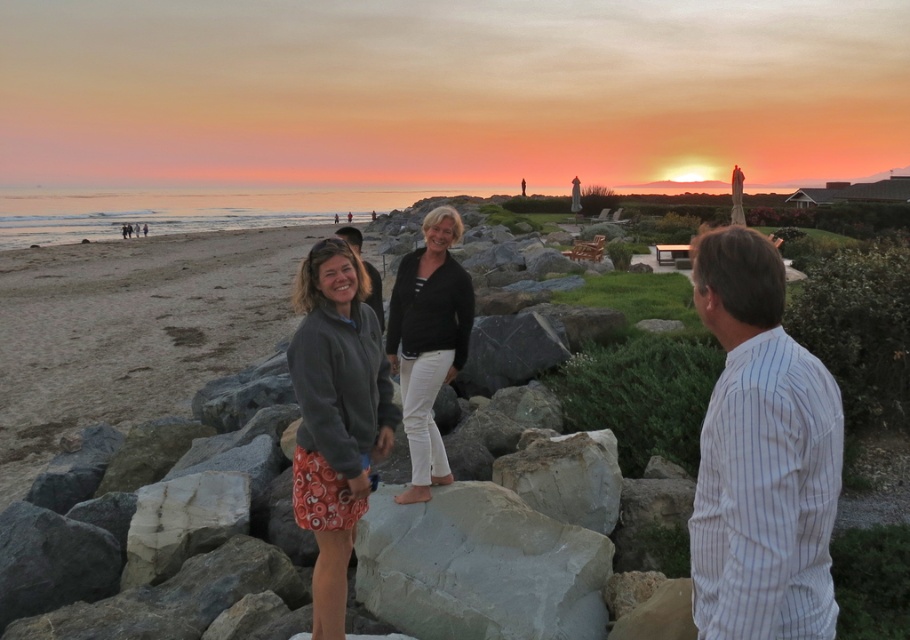
Is gray smooth rock at center thinner than white cotton pants at center?

No.

Who is higher up, gray smooth rock at center or white cotton pants at center?

Positioned higher is white cotton pants at center.

Does point (541, 572) come farther from viewer compared to point (436, 214)?

No, (541, 572) is closer to viewer.

Identify the location of gray smooth rock at center. The width and height of the screenshot is (910, 640). (479, 566).

Is point (298, 381) positioned in front of point (383, 312)?

Yes, point (298, 381) is in front of point (383, 312).

Is orange printed skirt at center smaller than white shirt at center?

Correct, orange printed skirt at center occupies less space than white shirt at center.

You are a GUI agent. You are given a task and a screenshot of the screen. Output one action in this format:
    pyautogui.click(x=<x>, y=<y>)
    Task: Click on the orange printed skirt at center
    
    Given the screenshot: What is the action you would take?
    pyautogui.click(x=335, y=417)

How far apart are white cotton pants at center and white marble rock at center?

5.99 feet

Who is more forward, (450, 243) or (599, 456)?

Point (450, 243) is more forward.

Is point (455, 289) farther from viewer compared to point (539, 448)?

No, it is in front of (539, 448).

Locate an element on the screen. This screenshot has height=640, width=910. white cotton pants at center is located at coordinates (428, 342).